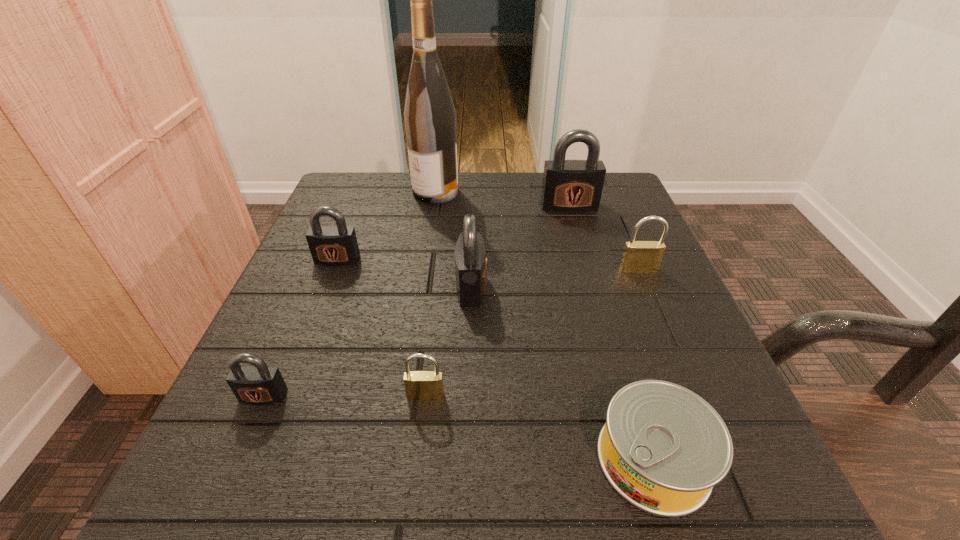
Find the location of a particular element. The height and width of the screenshot is (540, 960). the tallest object is located at coordinates (430, 122).

The image size is (960, 540). What are the coordinates of `the rightmost gray padlock` in the screenshot? It's located at (571, 186).

This screenshot has width=960, height=540. Find the location of `the fifth padlock from left to right`. the fifth padlock from left to right is located at coordinates (571, 186).

Identify the location of the fifth shortest padlock. (470, 253).

You are a GUI agent. You are given a task and a screenshot of the screen. Output one action in this format:
    pyautogui.click(x=<x>, y=<y>)
    Task: Click on the third farthest gray padlock
    The width and height of the screenshot is (960, 540).
    Given the screenshot: What is the action you would take?
    pyautogui.click(x=470, y=253)

Locate an element on the screen. This screenshot has width=960, height=540. the third biggest gray padlock is located at coordinates (333, 245).

Locate an element on the screen. the bigger brass padlock is located at coordinates (638, 256).

Where is `the farther brass padlock`? The image size is (960, 540). the farther brass padlock is located at coordinates (638, 256).

Where is `the nearest gray padlock`? The height and width of the screenshot is (540, 960). the nearest gray padlock is located at coordinates (259, 384).

The image size is (960, 540). Find the location of `the third padlock from left to right`. the third padlock from left to right is located at coordinates (419, 385).